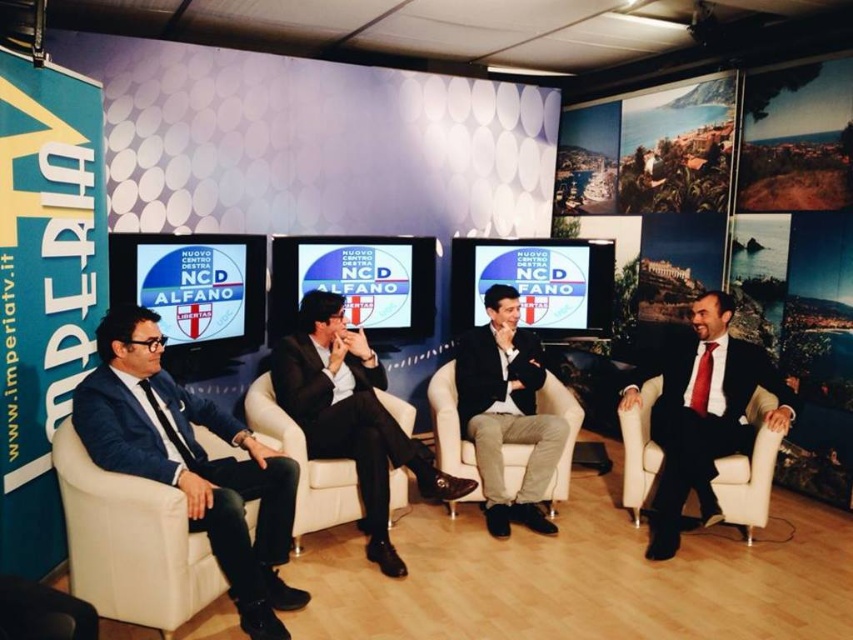
You are a costume designer preparing for a TV show. You have two suits available for the lead actor. The matte black suit at left and the dark blue fabric suit at center. The actor prefers a suit that is more prominent and stands out in the scene. Which suit should you choose?

The matte black suit at left is larger in size than the dark blue fabric suit at center, so the matte black suit at left would be more prominent and stand out in the scene.

You are a camera operator adjusting the camera focus for a live broadcast. You need to focus on both the point at (x=692, y=424) and the point at (x=529, y=460). Which point should you focus on first to ensure the subject closer to the camera is in focus?

You should focus on point (x=692, y=424) first because it is in front of point (x=529, y=460), meaning it is closer to the camera and requires immediate focus adjustment.